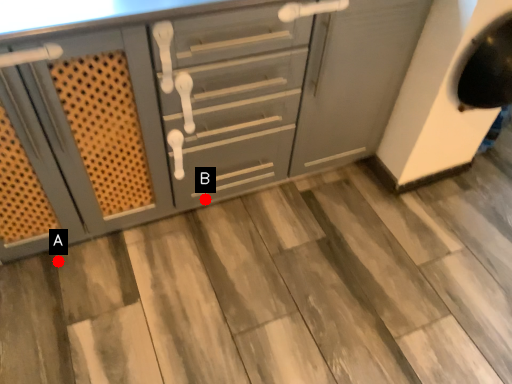
Question: Two points are circled on the image, labeled by A and B beside each circle. Among these points, which one is farthest from the camera?

Choices:
 (A) A is further
 (B) B is further

Answer: (B)